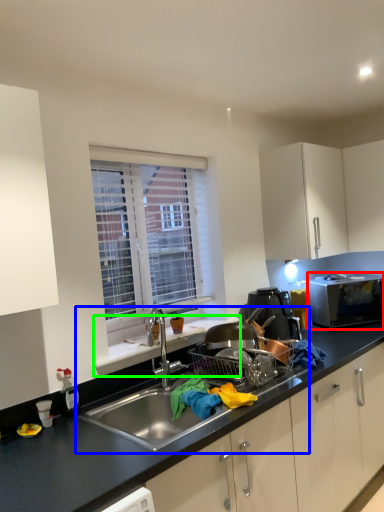
Question: Based on their relative distances, which object is nearer to microwave oven (highlighted by a red box)? Choose from sink (highlighted by a blue box) and window sill (highlighted by a green box).

Choices:
 (A) sink
 (B) window sill

Answer: (B)